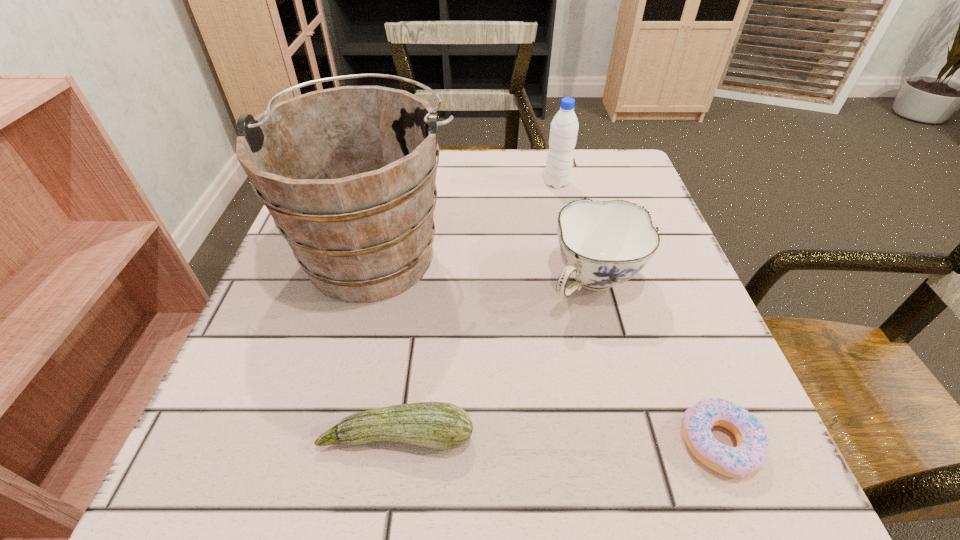
The width and height of the screenshot is (960, 540). In order to click on blank area located on the left of the chinaware in this screenshot , I will do `click(364, 282)`.

Where is `free point located 0.050m at the stem end of the zucchini`? free point located 0.050m at the stem end of the zucchini is located at coordinates (389, 498).

Where is `vacant area located on the left of the shortest object`? vacant area located on the left of the shortest object is located at coordinates (389, 444).

This screenshot has width=960, height=540. Identify the location of bucket present at the far edge. tap(348, 174).

Identify the location of water bottle that is positioned at the far edge. tap(564, 127).

Find the location of a particular element. The width and height of the screenshot is (960, 540). zucchini at the near edge is located at coordinates (439, 425).

Where is `doughnut that is at the near edge`? This screenshot has width=960, height=540. doughnut that is at the near edge is located at coordinates (752, 450).

You are a GUI agent. You are given a task and a screenshot of the screen. Output one action in this format:
    pyautogui.click(x=<x>, y=<y>)
    Task: Click on the bucket that is at the left edge
    The image size is (960, 540).
    Given the screenshot: What is the action you would take?
    pyautogui.click(x=348, y=174)

You are a GUI agent. You are given a task and a screenshot of the screen. Output one action in this format:
    pyautogui.click(x=<x>, y=<y>)
    Task: Click on the zucchini that is at the left edge
    This screenshot has height=540, width=960.
    Given the screenshot: What is the action you would take?
    pyautogui.click(x=439, y=425)

Find the location of a particular element. Image resolution: width=960 pixels, height=540 pixels. chinaware that is positioned at the right edge is located at coordinates (603, 243).